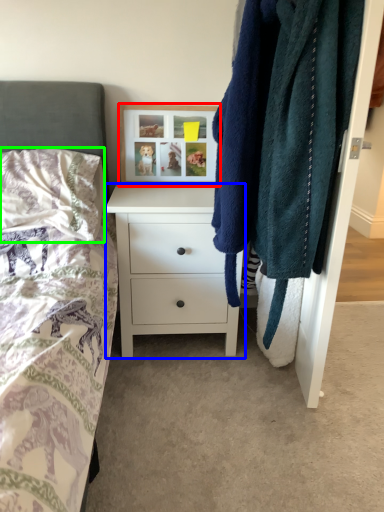
Question: Considering the real-world distances, which object is closest to picture frame (highlighted by a red box)? chest of drawers (highlighted by a blue box) or pillow (highlighted by a green box).

Choices:
 (A) chest of drawers
 (B) pillow

Answer: (A)